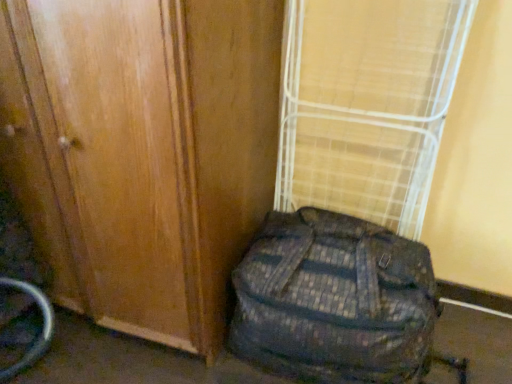
Question: Should I look upward or downward to see camouflage fabric backpack at lower right?

Choices:
 (A) down
 (B) up

Answer: (A)

Question: Is bamboo mat at center located within camouflage fabric backpack at lower right?

Choices:
 (A) no
 (B) yes

Answer: (A)

Question: Is camouflage fabric backpack at lower right thinner than bamboo mat at center?

Choices:
 (A) no
 (B) yes

Answer: (A)

Question: Does camouflage fabric backpack at lower right turn towards bamboo mat at center?

Choices:
 (A) yes
 (B) no

Answer: (B)

Question: Would you consider camouflage fabric backpack at lower right to be distant from bamboo mat at center?

Choices:
 (A) yes
 (B) no

Answer: (B)

Question: Does camouflage fabric backpack at lower right have a greater height compared to bamboo mat at center?

Choices:
 (A) no
 (B) yes

Answer: (A)

Question: Is camouflage fabric backpack at lower right outside of bamboo mat at center?

Choices:
 (A) yes
 (B) no

Answer: (A)

Question: From the image's perspective, is wooden door at center on top of bamboo mat at center?

Choices:
 (A) no
 (B) yes

Answer: (A)

Question: From a real-world perspective, is wooden door at center physically above bamboo mat at center?

Choices:
 (A) yes
 (B) no

Answer: (B)

Question: Does wooden door at center appear on the right side of bamboo mat at center?

Choices:
 (A) no
 (B) yes

Answer: (A)

Question: Is wooden door at center aimed at bamboo mat at center?

Choices:
 (A) no
 (B) yes

Answer: (A)

Question: Is wooden door at center in contact with bamboo mat at center?

Choices:
 (A) yes
 (B) no

Answer: (B)

Question: Does wooden door at center have a lesser height compared to bamboo mat at center?

Choices:
 (A) yes
 (B) no

Answer: (B)

Question: Is bamboo mat at center further to the viewer compared to wooden door at center?

Choices:
 (A) no
 (B) yes

Answer: (B)